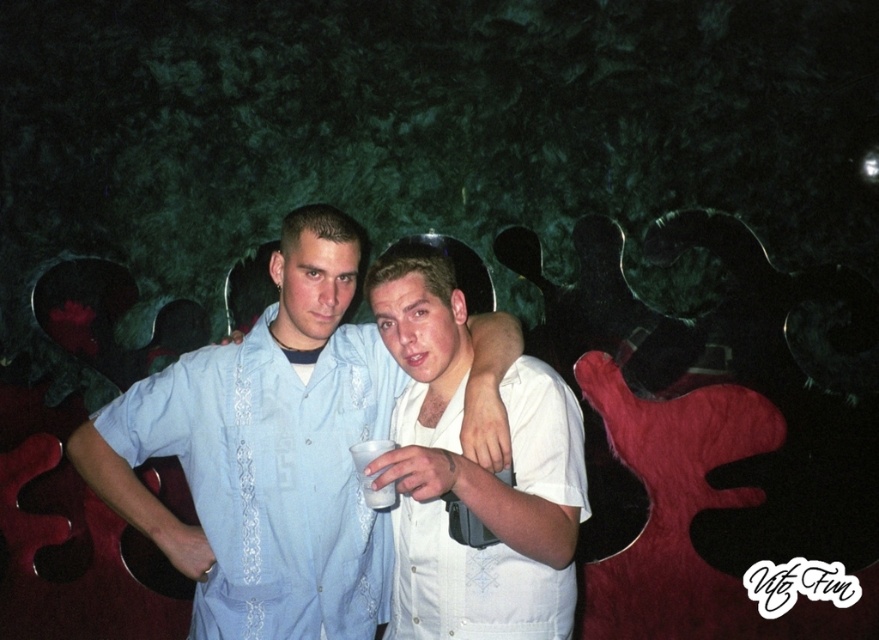
Question: Which point is closer to the camera?

Choices:
 (A) (365, 483)
 (B) (339, 288)

Answer: (A)

Question: Does light blue embroidered shirt at center have a greater width compared to white matte cup at center?

Choices:
 (A) no
 (B) yes

Answer: (B)

Question: Which object is closer to the camera taking this photo?

Choices:
 (A) light blue embroidered shirt at center
 (B) white matte cup at center

Answer: (B)

Question: From the image, what is the correct spatial relationship of light blue embroidered shirt at center in relation to white cotton shirt at center?

Choices:
 (A) left
 (B) right

Answer: (A)

Question: Which object is closer to the camera taking this photo?

Choices:
 (A) white cotton shirt at center
 (B) light blue embroidered shirt at center

Answer: (A)

Question: Can you confirm if light blue embroidered shirt at center is positioned to the left of white cotton shirt at center?

Choices:
 (A) no
 (B) yes

Answer: (B)